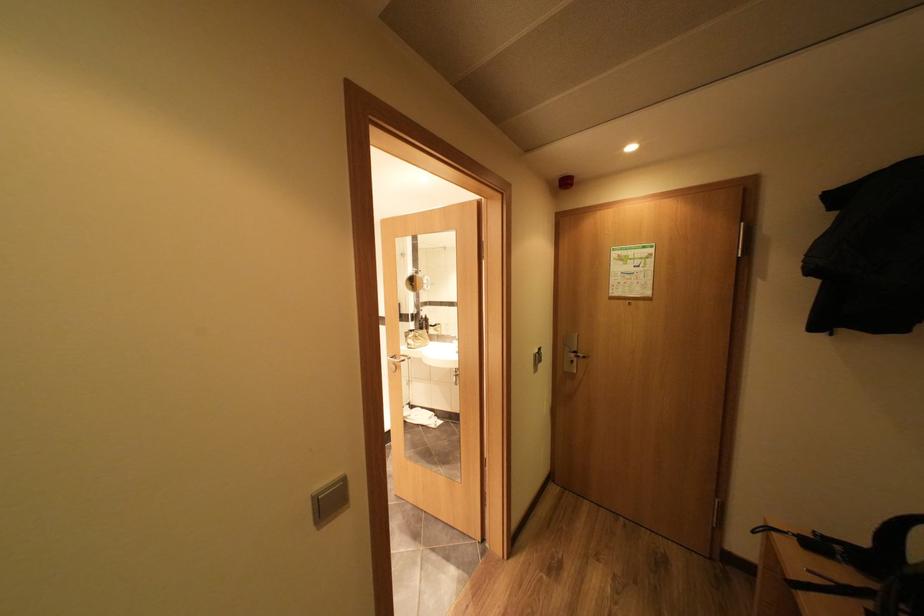
Describe the element at coordinates (330, 500) in the screenshot. This screenshot has height=616, width=924. I see `a silver light switch` at that location.